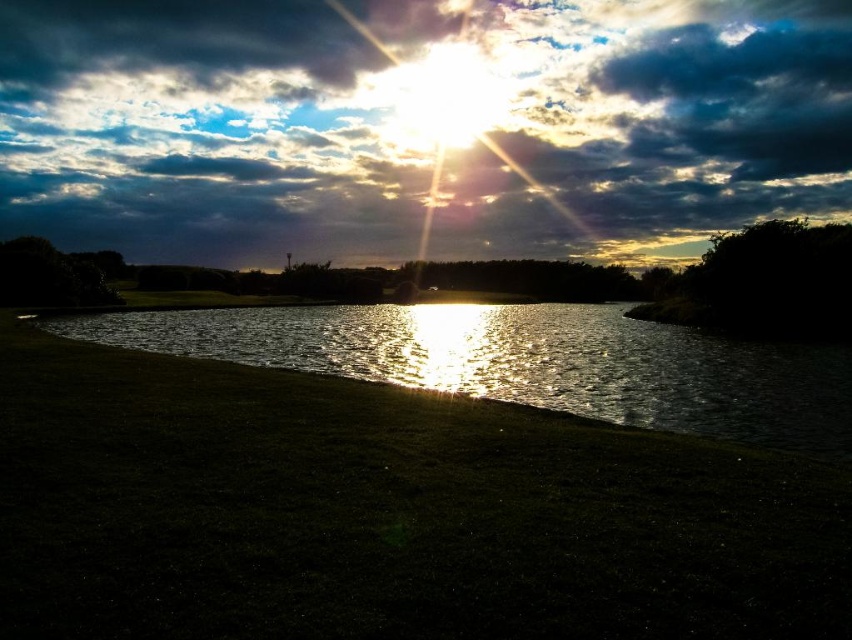
From the picture: You are standing at the water edge and want to take a photo of the cloudy sky at upper center. According to the coordinates provided, where should you aim your camera?

You should aim your camera at point (413, 132) to capture the cloudy sky at upper center.

You are an artist planning to paint the sunset scene. You need to ensure the cloudy sky at upper center and the glistening water at center are placed correctly. According to the scene, which object is located to the right of the other?

The cloudy sky at upper center is positioned on the right side of glistening water at center.